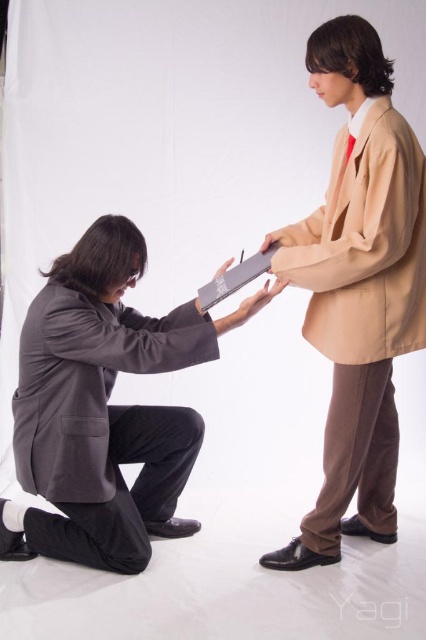
Which is behind, point (374, 269) or point (66, 365)?

Positioned behind is point (66, 365).

Locate an element on the screen. The image size is (426, 640). beige fabric business suit at upper right is located at coordinates (362, 308).

The width and height of the screenshot is (426, 640). Identify the location of beige fabric business suit at upper right. (362, 308).

Is dark gray wool business suit at lower left to the right of matte gray paper at center from the viewer's perspective?

In fact, dark gray wool business suit at lower left is to the left of matte gray paper at center.

Is dark gray wool business suit at lower left bigger than matte gray paper at center?

Correct, dark gray wool business suit at lower left is larger in size than matte gray paper at center.

Measure the distance between dark gray wool business suit at lower left and camera.

1.72 meters

The width and height of the screenshot is (426, 640). What are the coordinates of `dark gray wool business suit at lower left` in the screenshot? It's located at (101, 424).

In the scene shown: Between beige fabric business suit at upper right and matte gray paper at center, which one is positioned higher?

matte gray paper at center

Which is in front, point (367, 387) or point (261, 305)?

Point (261, 305)

Image resolution: width=426 pixels, height=640 pixels. Find the location of `beige fabric business suit at upper right`. beige fabric business suit at upper right is located at coordinates (362, 308).